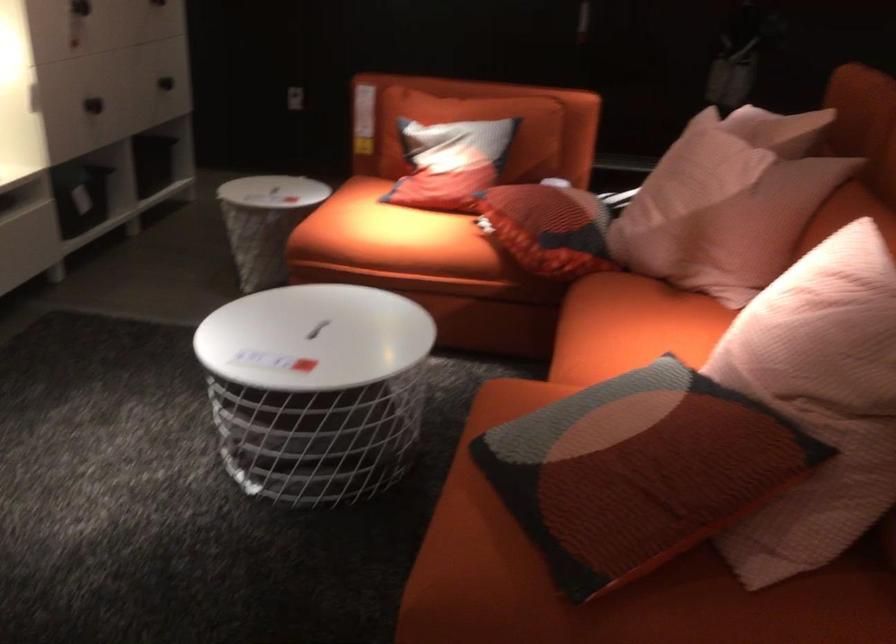
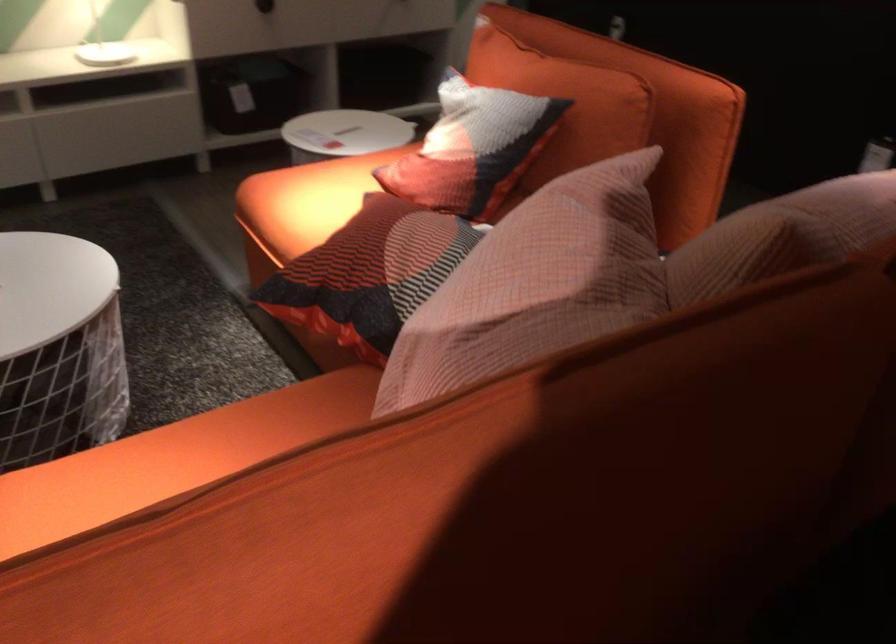
Find the pixel in the second image that matches (367,229) in the first image.

(306, 200)